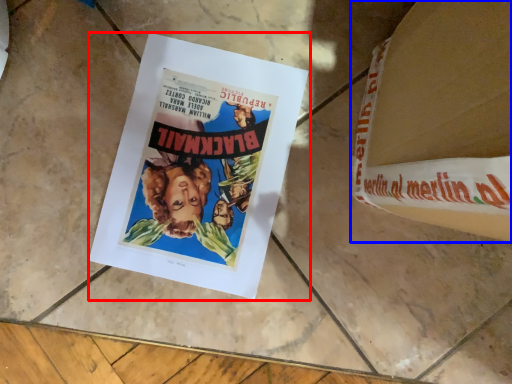
Question: Which object appears closest to the camera in this image, poster (highlighted by a red box) or paperback book (highlighted by a blue box)?

Choices:
 (A) poster
 (B) paperback book

Answer: (B)